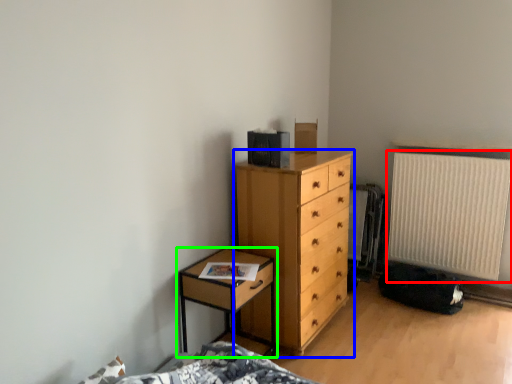
Question: Which object is the farthest from radiator (highlighted by a red box)? Choose among these: chest of drawers (highlighted by a blue box) or nightstand (highlighted by a green box).

Choices:
 (A) chest of drawers
 (B) nightstand

Answer: (B)